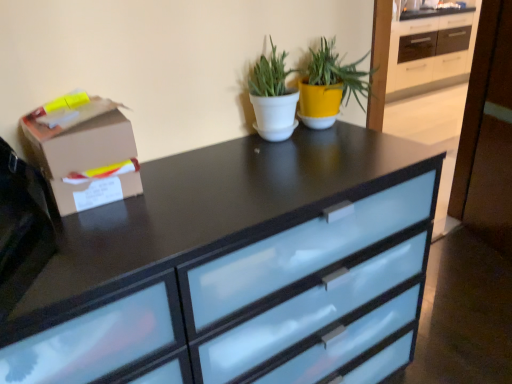
Question: Is brown cardboard box at left to the left of satin black chest of drawers at center from the viewer's perspective?

Choices:
 (A) no
 (B) yes

Answer: (B)

Question: Is brown cardboard box at left far from satin black chest of drawers at center?

Choices:
 (A) no
 (B) yes

Answer: (A)

Question: From a real-world perspective, is brown cardboard box at left positioned over satin black chest of drawers at center based on gravity?

Choices:
 (A) yes
 (B) no

Answer: (A)

Question: From the image's perspective, is brown cardboard box at left located beneath satin black chest of drawers at center?

Choices:
 (A) no
 (B) yes

Answer: (A)

Question: Considering the relative sizes of brown cardboard box at left and satin black chest of drawers at center in the image provided, is brown cardboard box at left wider than satin black chest of drawers at center?

Choices:
 (A) yes
 (B) no

Answer: (B)

Question: Is satin black chest of drawers at center a part of brown cardboard box at left?

Choices:
 (A) no
 (B) yes

Answer: (A)

Question: From a real-world perspective, is white matte pot at center, which is counted as the first houseplant, starting from the left, located beneath yellow matte pot at upper center, the 2th houseplant positioned from the left?

Choices:
 (A) no
 (B) yes

Answer: (B)

Question: Is white matte pot at center, the second houseplant viewed from the right, next to yellow matte pot at upper center, the 2th houseplant positioned from the left?

Choices:
 (A) yes
 (B) no

Answer: (B)

Question: From the image's perspective, would you say white matte pot at center, which is counted as the first houseplant, starting from the left, is positioned over yellow matte pot at upper center, the 2th houseplant positioned from the left?

Choices:
 (A) yes
 (B) no

Answer: (B)

Question: Is white matte pot at center, the second houseplant viewed from the right, positioned far away from yellow matte pot at upper center, the first houseplant in the right-to-left sequence?

Choices:
 (A) no
 (B) yes

Answer: (A)

Question: Is white matte pot at center, which is counted as the first houseplant, starting from the left, aimed at yellow matte pot at upper center, the first houseplant in the right-to-left sequence?

Choices:
 (A) yes
 (B) no

Answer: (B)

Question: Can you confirm if white matte pot at center, which is counted as the first houseplant, starting from the left, is wider than yellow matte pot at upper center, the first houseplant in the right-to-left sequence?

Choices:
 (A) no
 (B) yes

Answer: (A)

Question: Is the position of satin black chest of drawers at center less distant than that of white matte pot at center, which is counted as the first houseplant, starting from the left?

Choices:
 (A) no
 (B) yes

Answer: (B)